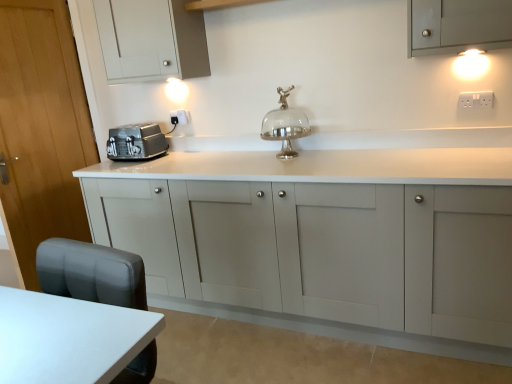
Question: Does white plastic electric outlet at upper right, which ranks as the first electric outlet in front-to-back order, turn towards matte gray cabinet at center, the 2th cabinetry viewed from the top?

Choices:
 (A) no
 (B) yes

Answer: (A)

Question: From the image's perspective, is white plastic electric outlet at upper right, the 2th electric outlet in the left-to-right sequence, under matte gray cabinet at center, positioned as the 1th cabinetry in bottom-to-top order?

Choices:
 (A) no
 (B) yes

Answer: (A)

Question: Is white plastic electric outlet at upper right, which ranks as the first electric outlet in front-to-back order, further to the viewer compared to matte gray cabinet at center, the 2th cabinetry viewed from the top?

Choices:
 (A) no
 (B) yes

Answer: (B)

Question: Is white plastic electric outlet at upper right, which ranks as the first electric outlet in front-to-back order, positioned far away from matte gray cabinet at center, positioned as the 1th cabinetry in bottom-to-top order?

Choices:
 (A) no
 (B) yes

Answer: (B)

Question: From a real-world perspective, is white plastic electric outlet at upper right, which ranks as the first electric outlet in front-to-back order, under matte gray cabinet at center, the 2th cabinetry viewed from the top?

Choices:
 (A) yes
 (B) no

Answer: (B)

Question: From a real-world perspective, relative to silver metallic cake stand at center, is white glossy table at lower left vertically above or below?

Choices:
 (A) above
 (B) below

Answer: (B)

Question: From their relative heights in the image, would you say white glossy table at lower left is taller or shorter than silver metallic cake stand at center?

Choices:
 (A) short
 (B) tall

Answer: (B)

Question: Considering the positions of white glossy table at lower left and silver metallic cake stand at center in the image, is white glossy table at lower left wider or thinner than silver metallic cake stand at center?

Choices:
 (A) thin
 (B) wide

Answer: (B)

Question: From the image's perspective, is white glossy table at lower left positioned above or below silver metallic cake stand at center?

Choices:
 (A) below
 (B) above

Answer: (A)

Question: Considering the positions of white glossy wall sconce at upper right and silver metallic cake stand at center in the image, is white glossy wall sconce at upper right wider or thinner than silver metallic cake stand at center?

Choices:
 (A) thin
 (B) wide

Answer: (A)

Question: In the image, is white glossy wall sconce at upper right positioned in front of or behind silver metallic cake stand at center?

Choices:
 (A) behind
 (B) front

Answer: (B)

Question: Is white glossy wall sconce at upper right bigger or smaller than silver metallic cake stand at center?

Choices:
 (A) small
 (B) big

Answer: (A)

Question: Is white glossy wall sconce at upper right inside or outside of silver metallic cake stand at center?

Choices:
 (A) inside
 (B) outside

Answer: (B)

Question: From a real-world perspective, is wooden door at left above or below matte white cabinet at upper left, the second cabinetry from the bottom?

Choices:
 (A) below
 (B) above

Answer: (A)

Question: In terms of height, does wooden door at left look taller or shorter compared to matte white cabinet at upper left, arranged as the first cabinetry when viewed from the top?

Choices:
 (A) short
 (B) tall

Answer: (B)